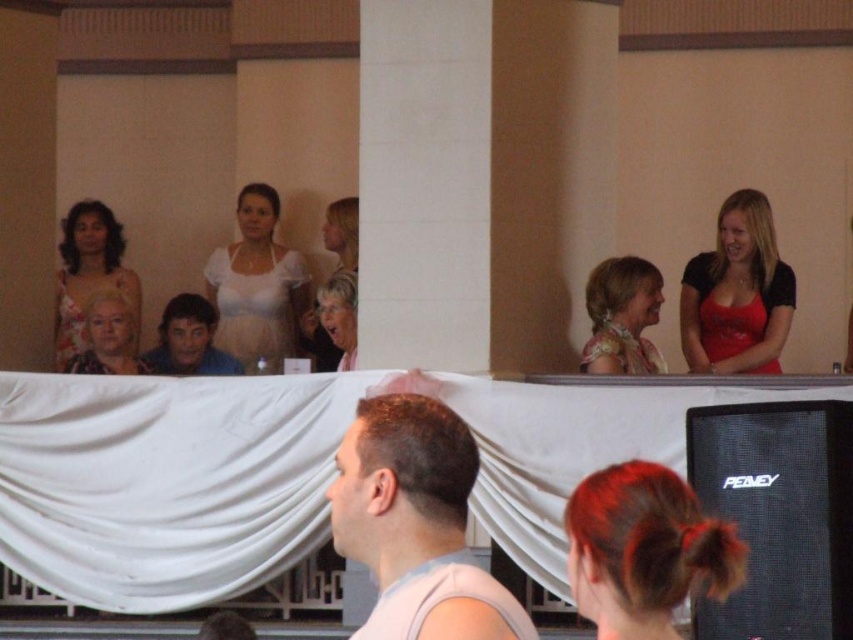
You are a photographer at the event and want to capture a photo of both the red satin dress at upper right and the matte floral dress at upper left in the same frame. Which dress will appear taller in the photo?

The matte floral dress at upper left will appear taller in the photo because it is taller than the red satin dress at upper right.

In the scene, there is a point labeled at coordinates (737, 292). Based on the image description, what object is located at this point?

The point at coordinates (737, 292) corresponds to the red satin dress at upper right.